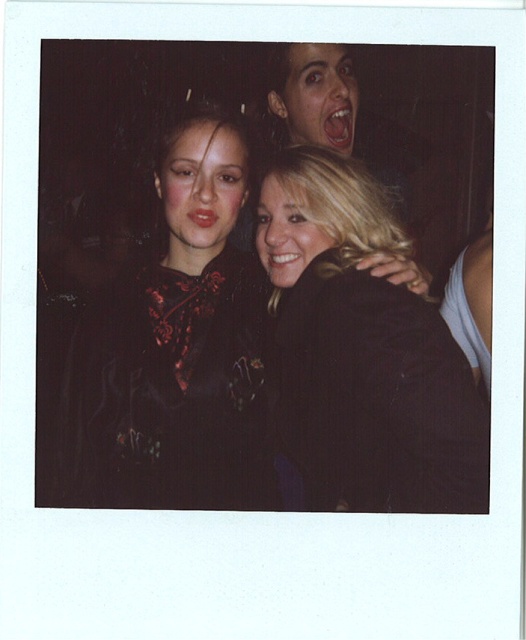
Question: Among these objects, which one is farthest from the camera?

Choices:
 (A) matte black blouse at center
 (B) blonde hair at center

Answer: (A)

Question: Does black textured jacket at center have a larger size compared to blonde hair at center?

Choices:
 (A) yes
 (B) no

Answer: (A)

Question: Can you confirm if black textured jacket at center is thinner than matte black blouse at center?

Choices:
 (A) yes
 (B) no

Answer: (B)

Question: Can you confirm if black textured jacket at center is bigger than matte black blouse at center?

Choices:
 (A) yes
 (B) no

Answer: (A)

Question: Among these points, which one is nearest to the camera?

Choices:
 (A) (x=428, y=308)
 (B) (x=278, y=184)

Answer: (A)

Question: Which point appears farthest from the camera in this image?

Choices:
 (A) (263, 324)
 (B) (170, 170)

Answer: (A)